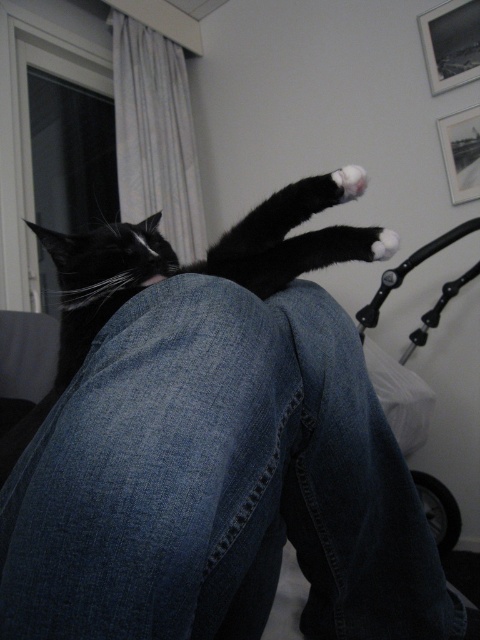
Question: Estimate the real-world distances between objects in this image. Which object is closer to the white matte paw at upper center?

Choices:
 (A) white fluffy paw at upper center
 (B) denim at center
 (C) black matte fur at center

Answer: (A)

Question: Can you confirm if white fluffy paw at upper center is positioned below white matte paw at upper center?

Choices:
 (A) yes
 (B) no

Answer: (B)

Question: Is denim at center wider than white fluffy paw at upper center?

Choices:
 (A) yes
 (B) no

Answer: (A)

Question: Which object appears farthest from the camera in this image?

Choices:
 (A) black matte fur at center
 (B) white matte paw at upper center

Answer: (B)

Question: Which point is closer to the camera?

Choices:
 (A) (376, 241)
 (B) (304, 218)

Answer: (A)

Question: Can you confirm if denim at center is positioned to the right of white matte paw at upper center?

Choices:
 (A) yes
 (B) no

Answer: (B)